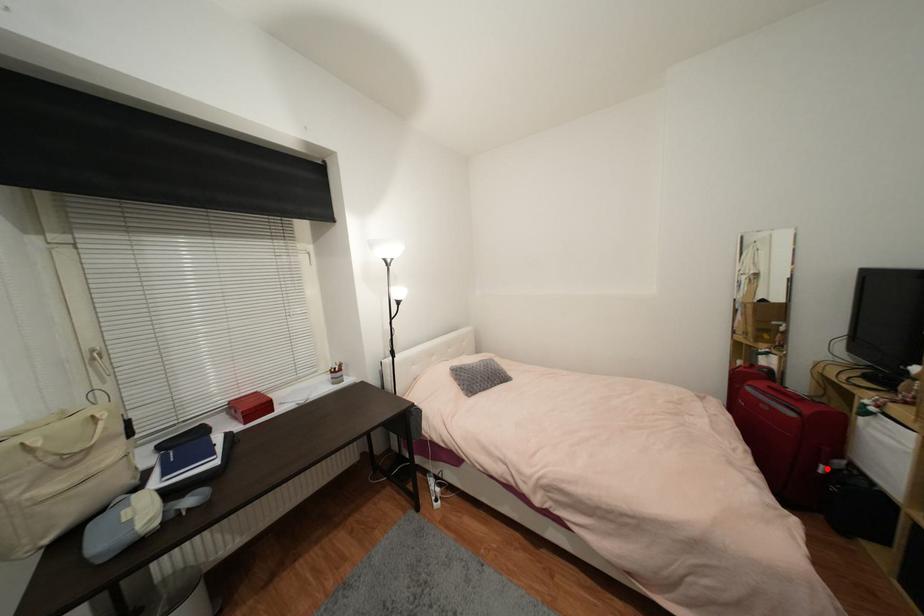
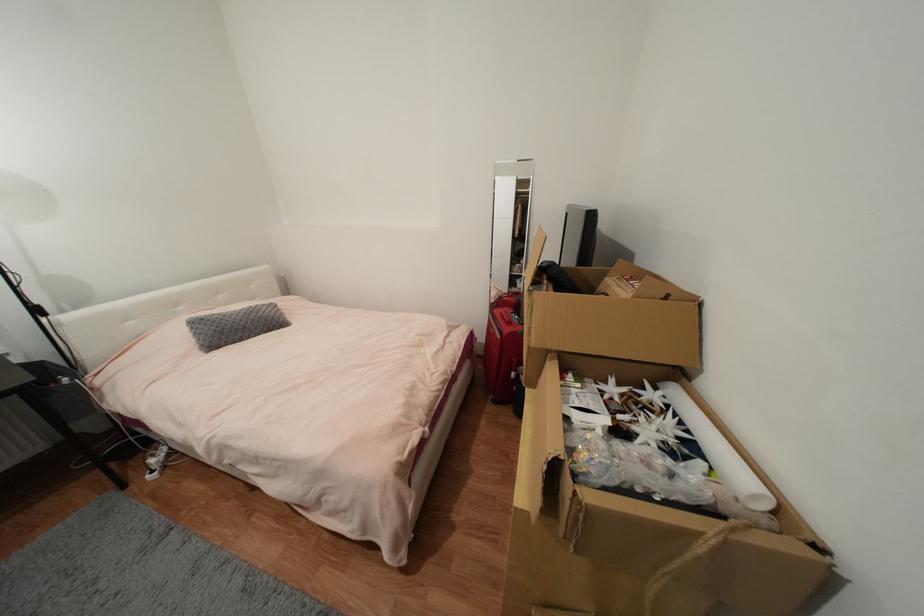
The point at the highlighted location is marked in the first image. Where is the corresponding point in the second image?

(517, 375)